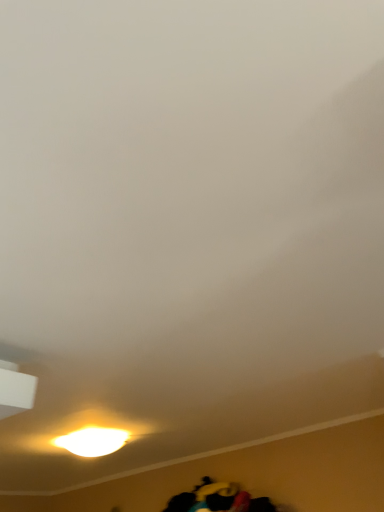
Image resolution: width=384 pixels, height=512 pixels. What do you see at coordinates (93, 441) in the screenshot?
I see `matte white lamp at lower left` at bounding box center [93, 441].

Identify the location of matte white lamp at lower left. (93, 441).

Locate an element on the screen. matte white lamp at lower left is located at coordinates (93, 441).